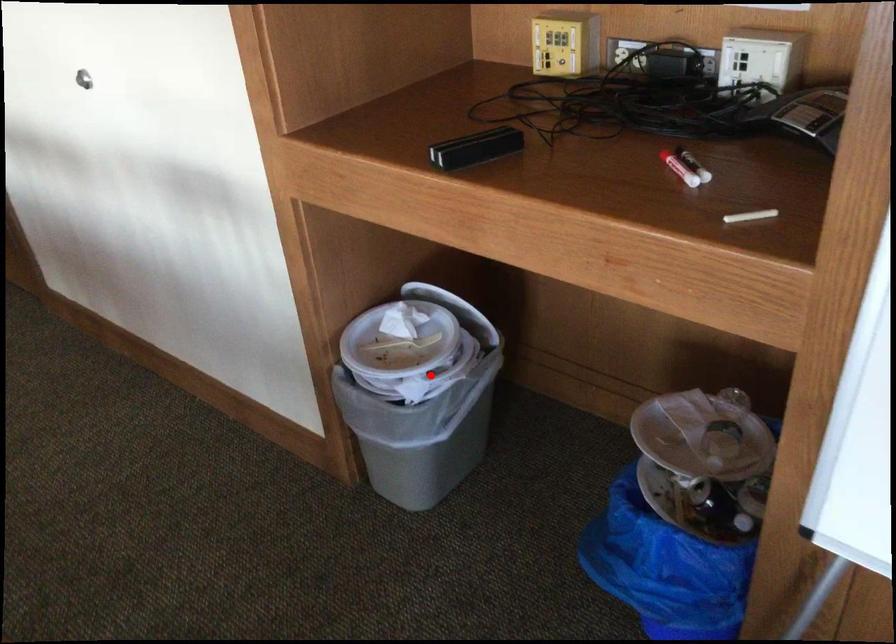
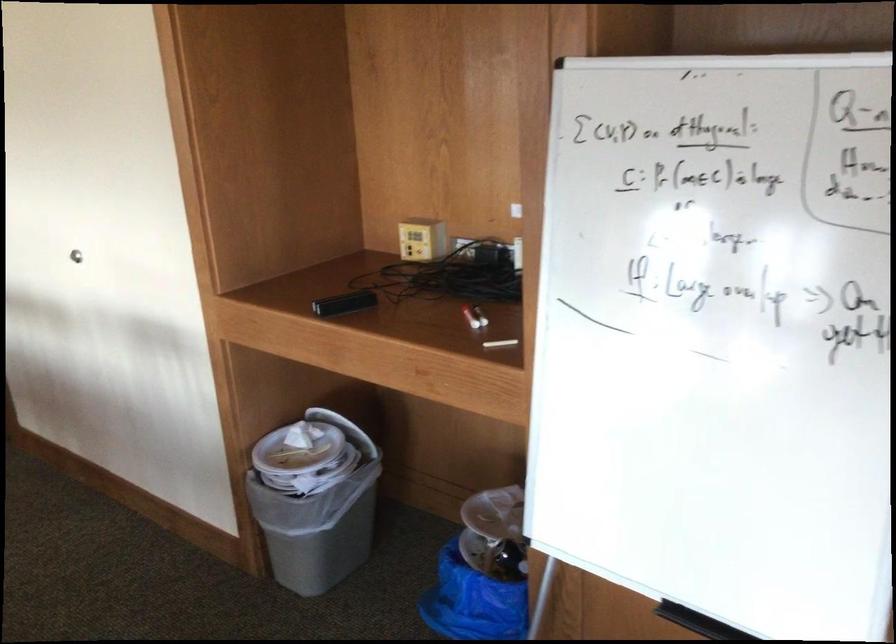
In the second image, find the point that corresponds to the highlighted location in the first image.

(315, 475)